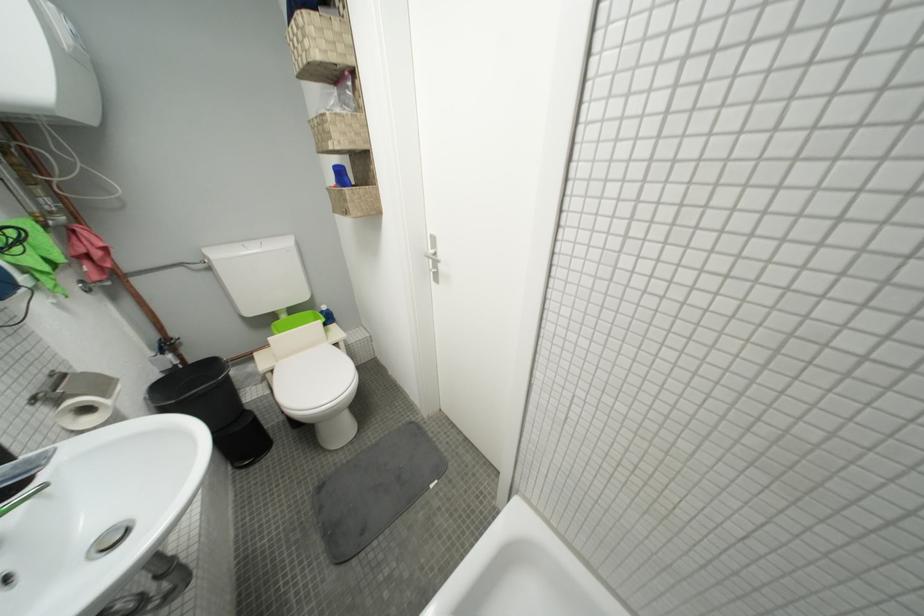
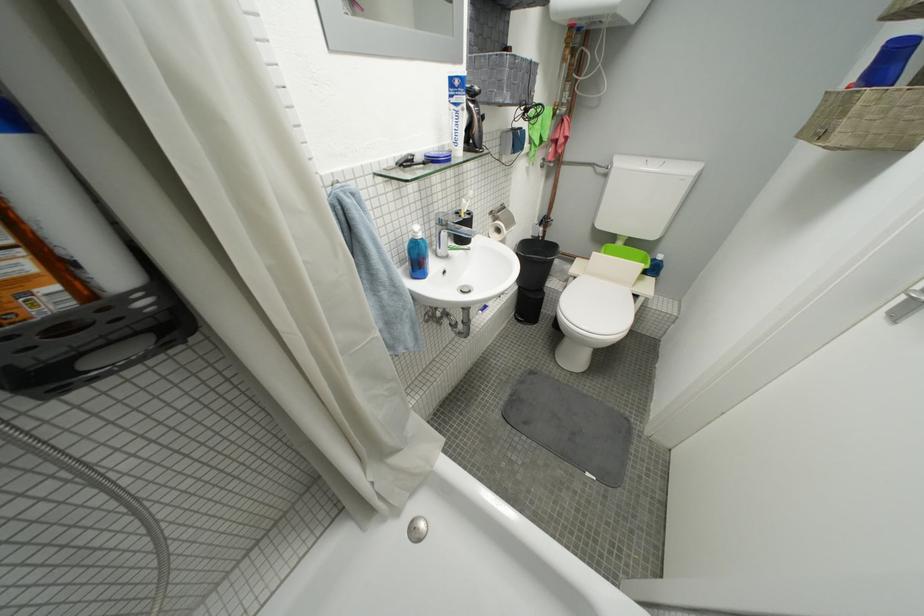
In the second image, find the point that corresponds to the point at 442,283 in the first image.

(900, 315)